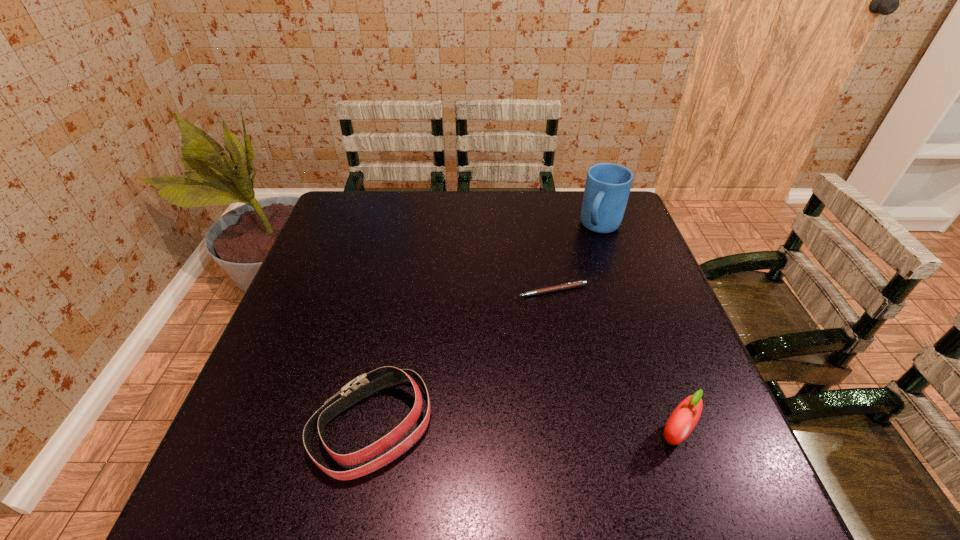
Locate an element on the screen. Image resolution: width=960 pixels, height=540 pixels. free space located 0.230m on the side of the farthest object with the handle is located at coordinates (568, 289).

The width and height of the screenshot is (960, 540). I want to click on free space located on the side of the farthest object with the handle, so click(547, 327).

Find the location of a particular element. vacant space located at the nib of the shortest object is located at coordinates (518, 382).

The width and height of the screenshot is (960, 540). In order to click on free space located at the nib of the shortest object in this screenshot , I will do `click(535, 329)`.

Where is `free space located at the nib of the shortest object`? free space located at the nib of the shortest object is located at coordinates (540, 311).

At what (x,y) coordinates should I click in order to perform the action: click on object that is at the far edge. Please return your answer as a coordinate pair (x, y). Looking at the image, I should click on (607, 188).

In order to click on dog collar at the near edge in this screenshot , I will do `click(364, 385)`.

At what (x,y) coordinates should I click in order to perform the action: click on apple at the near edge. Please return your answer as a coordinate pair (x, y). Looking at the image, I should click on (684, 418).

The width and height of the screenshot is (960, 540). Identify the location of object that is positioned at the left edge. (x=364, y=385).

Find the location of `apple present at the right edge`. apple present at the right edge is located at coordinates (684, 418).